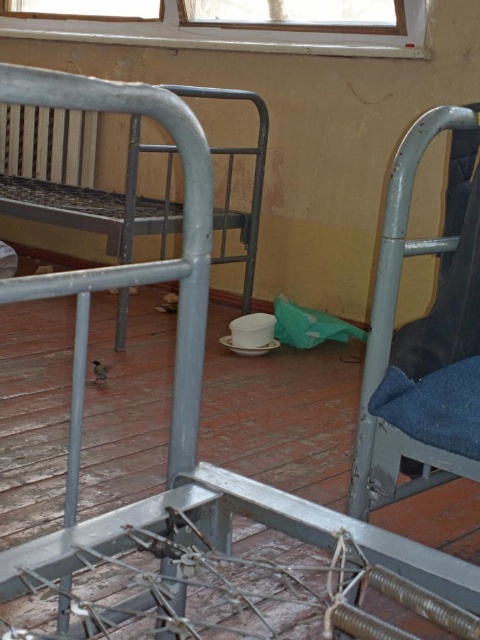
Between point (450, 464) and point (256, 38), which one is positioned behind?

The point (256, 38) is behind.

Looking at this image, is blue fabric chair at right closer to camera compared to wooden frame window at upper center?

Yes, blue fabric chair at right is closer to the viewer.

I want to click on blue fabric chair at right, so click(x=396, y=301).

Is metallic gray bed at left bigger than wooden frame window at upper center?

Yes.

Which is in front, point (224, 154) or point (296, 44)?

Point (296, 44) is in front.

Image resolution: width=480 pixels, height=640 pixels. Find the location of `metallic gray bed at left`. metallic gray bed at left is located at coordinates (100, 202).

Identify the location of metallic gray bed at left. (100, 202).

Measure the distance from metallic gray bed at left to blue fabric chair at right.

metallic gray bed at left is 1.99 meters away from blue fabric chair at right.

Image resolution: width=480 pixels, height=640 pixels. In order to click on metallic gray bed at left in this screenshot , I will do click(100, 202).

Find the location of `metallic gray bed at left`. metallic gray bed at left is located at coordinates (100, 202).